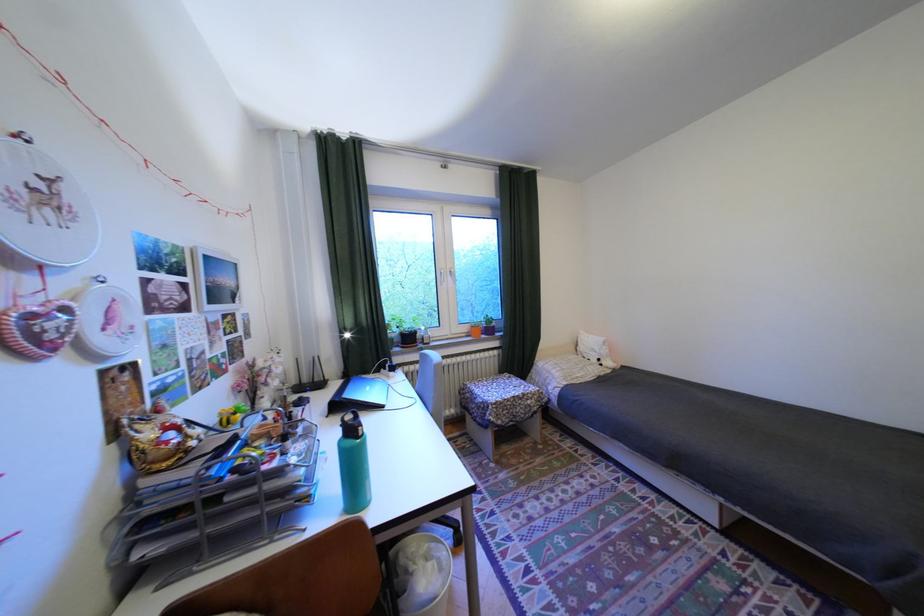
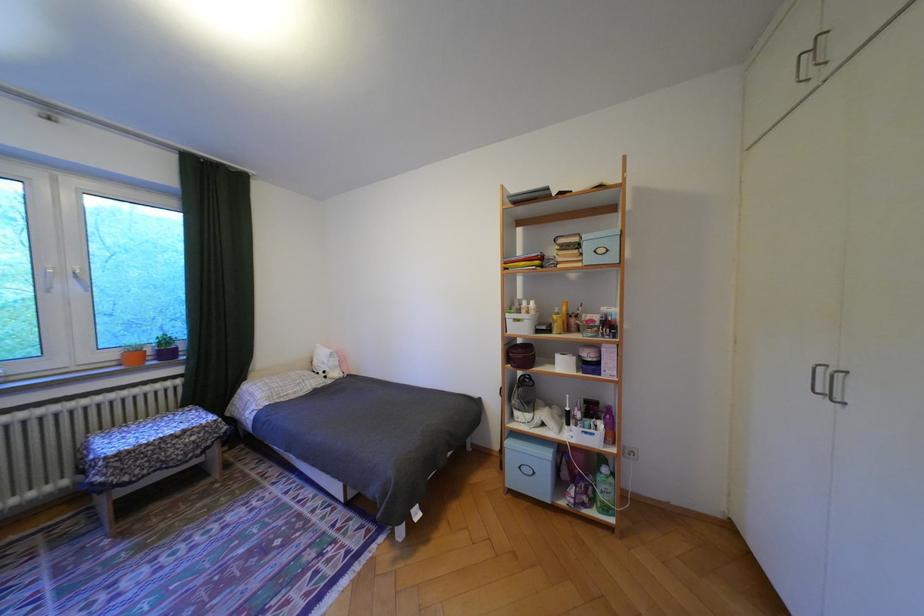
Locate, in the second image, the point that corresponds to point 460,277 in the first image.

(84, 280)